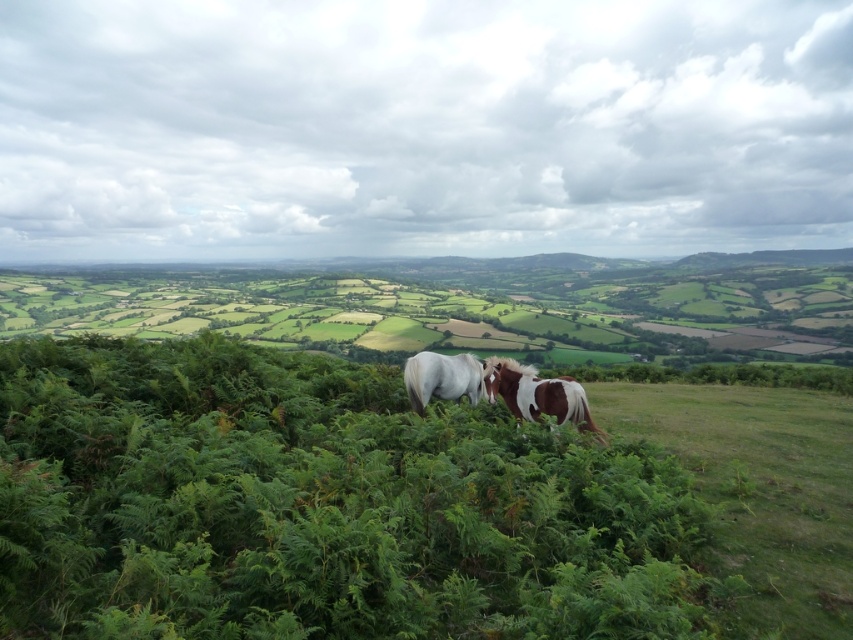
Is green leafy shrubs at center bigger than white glossy horse at center?

Correct, green leafy shrubs at center is larger in size than white glossy horse at center.

Is green leafy shrubs at center shorter than white glossy horse at center?

In fact, green leafy shrubs at center may be taller than white glossy horse at center.

The width and height of the screenshot is (853, 640). I want to click on green leafy shrubs at center, so click(x=318, y=506).

Can you confirm if pinto-patterned horse at center is thinner than white glossy horse at center?

No, pinto-patterned horse at center is not thinner than white glossy horse at center.

Does pinto-patterned horse at center appear under white glossy horse at center?

No.

Locate an element on the screen. The image size is (853, 640). pinto-patterned horse at center is located at coordinates coord(537,394).

Does green leafy shrubs at center come behind pinto-patterned horse at center?

No, it is not.

Which is behind, point (10, 417) or point (509, 394)?

Point (509, 394)

Find the location of a particular element. green leafy shrubs at center is located at coordinates (318, 506).